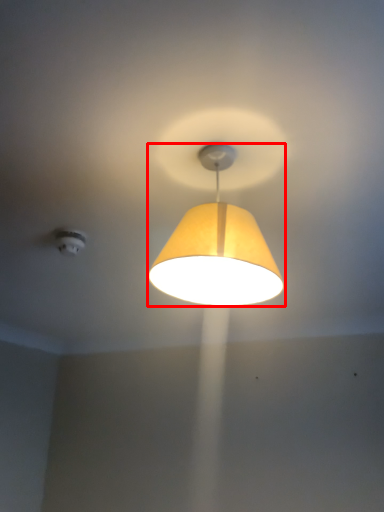
Question: From the image's perspective, what is the correct spatial positioning of lamp (annotated by the red box) in reference to lighting?

Choices:
 (A) above
 (B) below

Answer: (A)